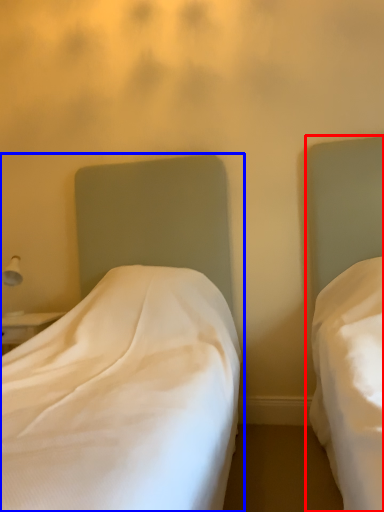
Question: Among these objects, which one is farthest to the camera, bed (highlighted by a red box) or bed (highlighted by a blue box)?

Choices:
 (A) bed
 (B) bed

Answer: (B)